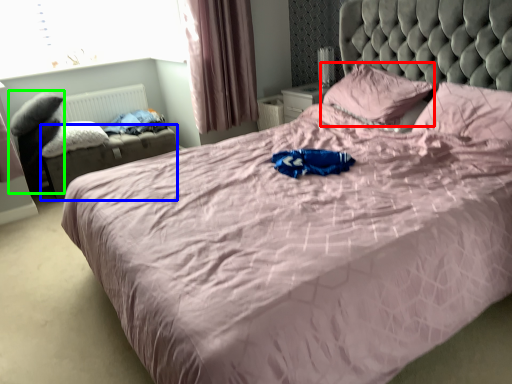
Question: Which object is the farthest from pillow (highlighted by a red box)? Choose among these: footrest (highlighted by a blue box) or swivel chair (highlighted by a green box).

Choices:
 (A) footrest
 (B) swivel chair

Answer: (B)